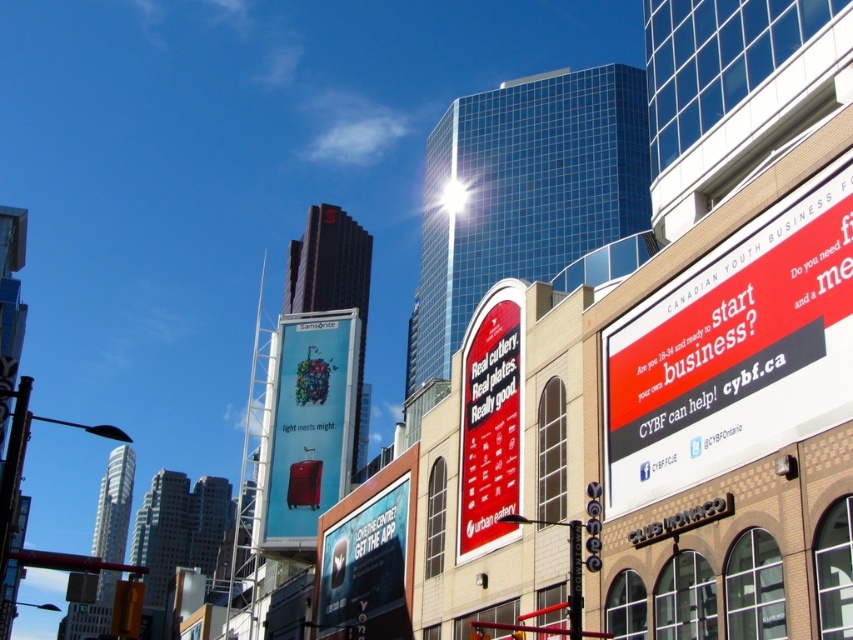
Is matte plastic suitcase at center bigger than white glossy billboard at center?

Yes, matte plastic suitcase at center is bigger than white glossy billboard at center.

Is point (337, 321) in front of point (405, 509)?

No, (337, 321) is further to viewer.

Where is `matte plastic suitcase at center`? This screenshot has height=640, width=853. matte plastic suitcase at center is located at coordinates [x=308, y=426].

Between matte plastic suitcase at center and red matte sign at center, which one appears on the left side from the viewer's perspective?

Positioned to the left is matte plastic suitcase at center.

Is point (294, 544) positioned in front of point (512, 451)?

No.

Where is `matte plastic suitcase at center`? This screenshot has width=853, height=640. matte plastic suitcase at center is located at coordinates (308, 426).

Find the location of a particular element. This screenshot has height=640, width=853. red matte sign at center is located at coordinates (x=490, y=420).

Who is lower down, red matte sign at center or white glossy billboard at center?

white glossy billboard at center is lower down.

Where is `red matte sign at center`? This screenshot has height=640, width=853. red matte sign at center is located at coordinates (490, 420).

Find the location of a particular element. red matte sign at center is located at coordinates (490, 420).